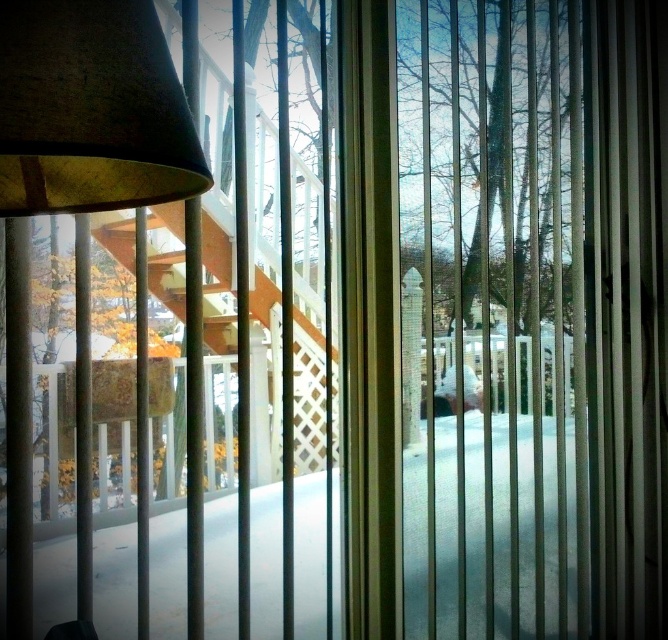
Question: Which point appears closest to the camera in this image?

Choices:
 (A) (593, 209)
 (B) (1, 124)

Answer: (B)

Question: Can you confirm if translucent plastic curtain at center is positioned to the left of matte brown lampshade at left?

Choices:
 (A) no
 (B) yes

Answer: (A)

Question: Is translucent plastic curtain at center smaller than matte brown lampshade at left?

Choices:
 (A) no
 (B) yes

Answer: (A)

Question: Which of the following is the closest to the observer?

Choices:
 (A) (613, 381)
 (B) (53, 54)

Answer: (B)

Question: Does translucent plastic curtain at center have a lesser width compared to matte brown lampshade at left?

Choices:
 (A) no
 (B) yes

Answer: (A)